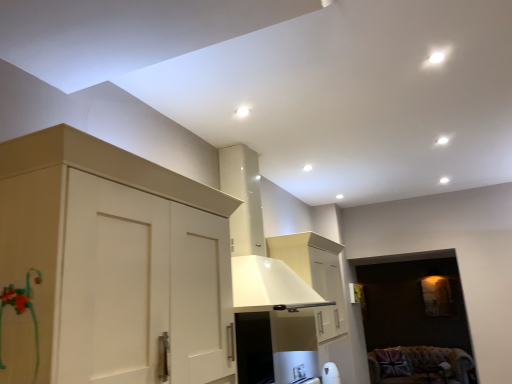
At what (x,y) coordinates should I click in order to perform the action: click on white matte cabinet at left. Please return your answer as a coordinate pair (x, y). Looking at the image, I should click on (111, 265).

This screenshot has height=384, width=512. What do you see at coordinates (111, 265) in the screenshot? I see `white matte cabinet at left` at bounding box center [111, 265].

The image size is (512, 384). What do you see at coordinates (419, 365) in the screenshot? I see `velvet union jack cushion at lower right` at bounding box center [419, 365].

Locate an element on the screen. Image resolution: width=512 pixels, height=384 pixels. velvet union jack cushion at lower right is located at coordinates (419, 365).

In order to click on white matte cabinet at left in this screenshot , I will do `click(111, 265)`.

Between velvet union jack cushion at lower right and white matte cabinet at left, which one appears on the left side from the viewer's perspective?

Positioned to the left is white matte cabinet at left.

Which is behind, velvet union jack cushion at lower right or white matte cabinet at left?

velvet union jack cushion at lower right is behind.

Does point (402, 382) lie in front of point (91, 173)?

That is False.

From the image's perspective, is velvet union jack cushion at lower right located above or below white matte cabinet at left?

From the image's perspective, velvet union jack cushion at lower right appears below white matte cabinet at left.

From a real-world perspective, between velvet union jack cushion at lower right and white matte cabinet at left, who is vertically lower?

velvet union jack cushion at lower right is physically lower.

In terms of width, does velvet union jack cushion at lower right look wider or thinner when compared to white matte cabinet at left?

Considering their sizes, velvet union jack cushion at lower right looks broader than white matte cabinet at left.

Which of these two, velvet union jack cushion at lower right or white matte cabinet at left, stands taller?

white matte cabinet at left.

Between velvet union jack cushion at lower right and white matte cabinet at left, which one has larger size?

velvet union jack cushion at lower right.

Is velvet union jack cushion at lower right not inside white matte cabinet at left?

Indeed, velvet union jack cushion at lower right is completely outside white matte cabinet at left.

Would you consider velvet union jack cushion at lower right to be distant from white matte cabinet at left?

Yes, velvet union jack cushion at lower right and white matte cabinet at left are quite far apart.

Is white matte cabinet at left at the back of velvet union jack cushion at lower right?

No, velvet union jack cushion at lower right is not facing the opposite direction of white matte cabinet at left.

What's the angular difference between velvet union jack cushion at lower right and white matte cabinet at left's facing directions?

85.1 degrees.

In order to click on furniture that is under the white matte cabinet at left (from a real-world perspective) in this screenshot , I will do `click(419, 365)`.

Does white matte cabinet at left appear on the left side of velvet union jack cushion at lower right?

Correct, you'll find white matte cabinet at left to the left of velvet union jack cushion at lower right.

Is white matte cabinet at left further to the viewer compared to velvet union jack cushion at lower right?

No, white matte cabinet at left is in front of velvet union jack cushion at lower right.

Is point (214, 380) closer to viewer compared to point (416, 381)?

Yes, it is in front of point (416, 381).

From the image's perspective, would you say white matte cabinet at left is positioned over velvet union jack cushion at lower right?

Indeed, from the image's perspective, white matte cabinet at left is shown above velvet union jack cushion at lower right.

From a real-world perspective, is white matte cabinet at left above or below velvet union jack cushion at lower right?

In terms of real-world spatial position, white matte cabinet at left is above velvet union jack cushion at lower right.

Considering the relative sizes of white matte cabinet at left and velvet union jack cushion at lower right in the image provided, is white matte cabinet at left thinner than velvet union jack cushion at lower right?

Correct, the width of white matte cabinet at left is less than that of velvet union jack cushion at lower right.

Considering the sizes of objects white matte cabinet at left and velvet union jack cushion at lower right in the image provided, who is taller, white matte cabinet at left or velvet union jack cushion at lower right?

Standing taller between the two is white matte cabinet at left.

Between white matte cabinet at left and velvet union jack cushion at lower right, which one has larger size?

With larger size is velvet union jack cushion at lower right.

Choose the correct answer: Is white matte cabinet at left inside velvet union jack cushion at lower right or outside it?

The correct answer is: outside.

Based on the photo, is white matte cabinet at left not close to velvet union jack cushion at lower right?

Yes, white matte cabinet at left and velvet union jack cushion at lower right are located far from each other.

Is white matte cabinet at left oriented towards velvet union jack cushion at lower right?

No, white matte cabinet at left is not turned towards velvet union jack cushion at lower right.

The height and width of the screenshot is (384, 512). I want to click on furniture lying behind the white matte cabinet at left, so click(419, 365).

Identify the location of furniture on the right side of white matte cabinet at left. The width and height of the screenshot is (512, 384). (419, 365).

This screenshot has width=512, height=384. Identify the location of cabinetry in front of the velvet union jack cushion at lower right. (111, 265).